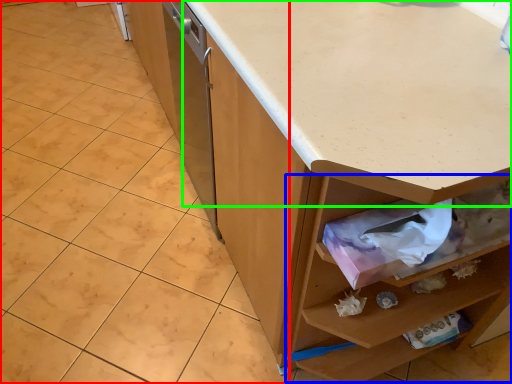
Question: Estimate the real-world distances between objects in this image. Which object is farther from granite (highlighted by a red box), drawer (highlighted by a blue box) or countertop (highlighted by a green box)?

Choices:
 (A) drawer
 (B) countertop

Answer: (B)